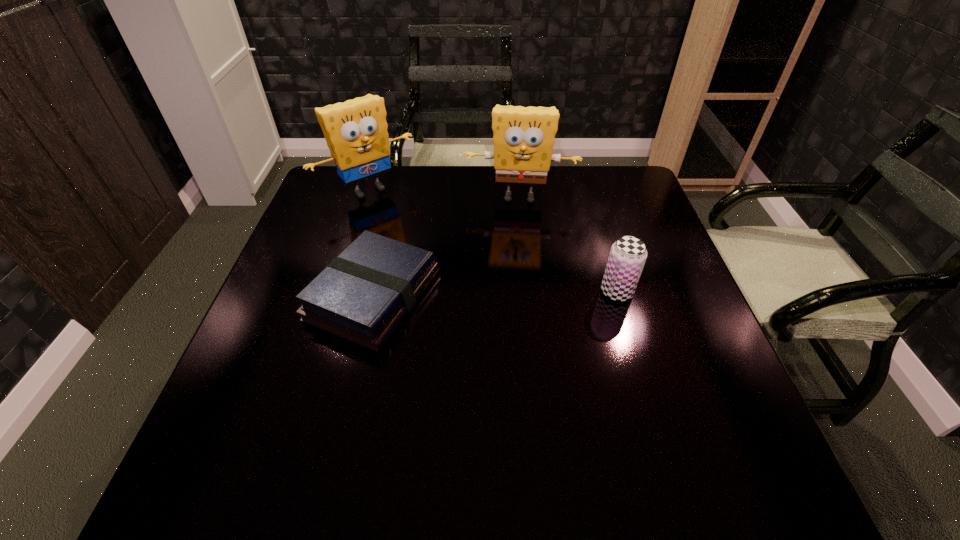
Identify the location of vacant space situated on the face of the third object from left to right. Image resolution: width=960 pixels, height=540 pixels. (515, 261).

I want to click on free location located on the face of the third object from left to right, so click(x=515, y=244).

Find the location of `free space located 0.150m on the face of the third object from left to right`. free space located 0.150m on the face of the third object from left to right is located at coordinates (515, 246).

Where is `book that is positioned at the left edge`? The image size is (960, 540). book that is positioned at the left edge is located at coordinates (363, 294).

At what (x,y) coordinates should I click in order to perform the action: click on sponge that is at the left edge. Please return your answer as a coordinate pair (x, y). This screenshot has height=540, width=960. Looking at the image, I should click on (356, 133).

Locate an element on the screen. object located in the right edge section of the desktop is located at coordinates (628, 254).

Identify the location of object situated at the far left corner. The image size is (960, 540). (356, 133).

Locate an element on the screen. The width and height of the screenshot is (960, 540). vacant space at the far edge is located at coordinates (541, 195).

Where is `free space at the near edge of the desktop`? The image size is (960, 540). free space at the near edge of the desktop is located at coordinates (398, 404).

Where is `free space at the left edge of the desktop`? free space at the left edge of the desktop is located at coordinates (307, 218).